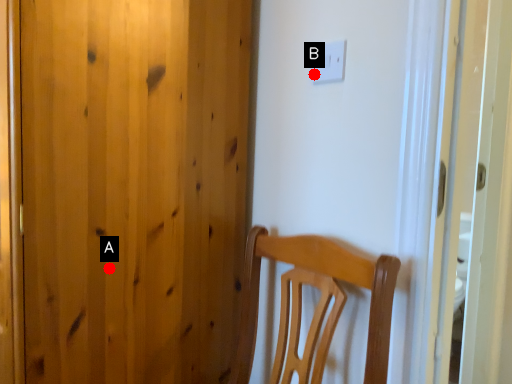
Question: Two points are circled on the image, labeled by A and B beside each circle. Which point appears farthest from the camera in this image?

Choices:
 (A) A is further
 (B) B is further

Answer: (B)